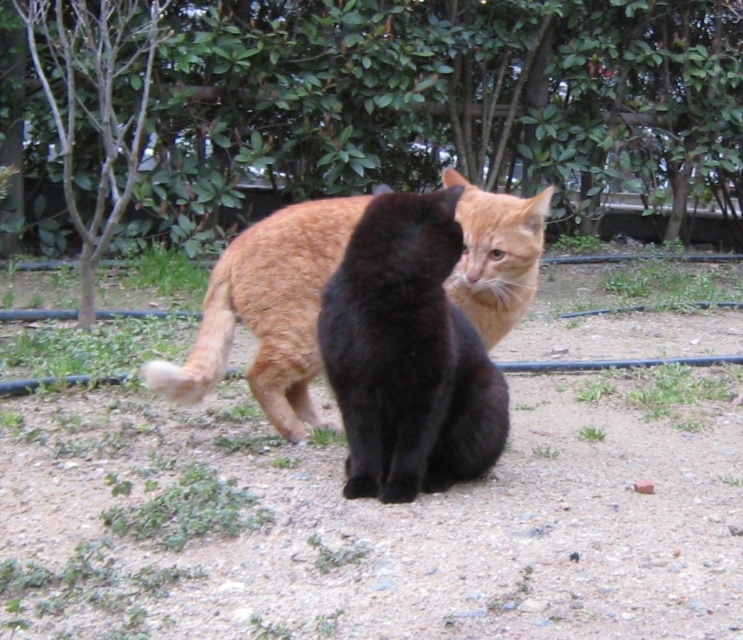
You are a photographer trying to capture the black fur cat at center. You notice a point at coordinates [408,355]. Where should you aim your camera to ensure you capture the black fur cat at center?

The point at coordinates [408,355] indicates the location of the black fur cat at center, so aim your camera at that point to capture it.

You are observing two cats in an outdoor area. You see the black fur cat at center and the orange fur cat at center. Which cat is positioned more to the right side of the image?

The black fur cat at center is to the right of the orange fur cat at center, so the black fur cat at center is more to the right side of the image.

You are a photographer trying to capture both cats in a single shot. Since the black fur cat at center is taller than the orange fur cat at center, which cat should you adjust your camera angle to focus on to ensure both are in focus?

Since the black fur cat at center is taller than the orange fur cat at center, you should adjust your camera angle to focus on the black fur cat at center to ensure both are in focus.